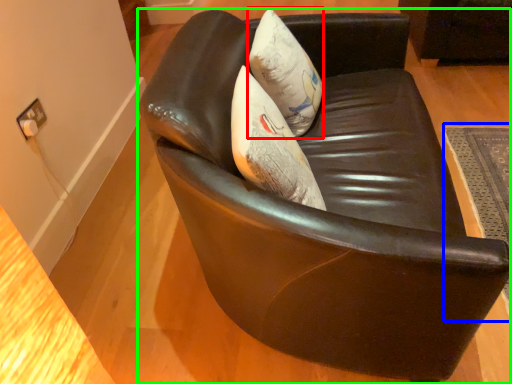
Question: Estimate the real-world distances between objects in this image. Which object is farther from throw pillow (highlighted by a red box), mat (highlighted by a blue box) or chair (highlighted by a green box)?

Choices:
 (A) mat
 (B) chair

Answer: (A)